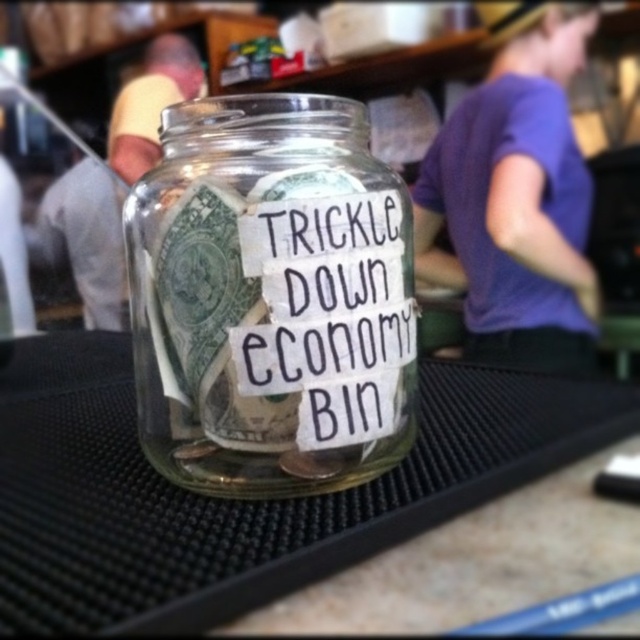
Question: Which of the following is the farthest from the observer?

Choices:
 (A) transparent glass jar at center
 (B) white paper label at center

Answer: (B)

Question: Is transparent glass jar at center positioned at the back of white paper label at center?

Choices:
 (A) yes
 (B) no

Answer: (B)

Question: Does transparent glass jar at center appear under white paper label at center?

Choices:
 (A) yes
 (B) no

Answer: (B)

Question: Which point is closer to the camera?

Choices:
 (A) white paper label at center
 (B) transparent glass jar at center

Answer: (B)

Question: Does transparent glass jar at center come in front of white paper label at center?

Choices:
 (A) yes
 (B) no

Answer: (A)